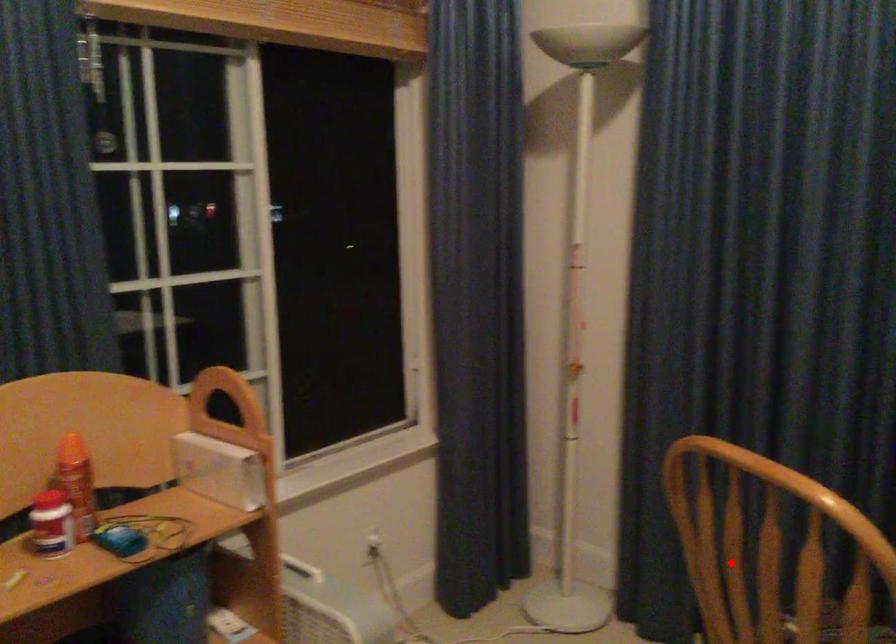
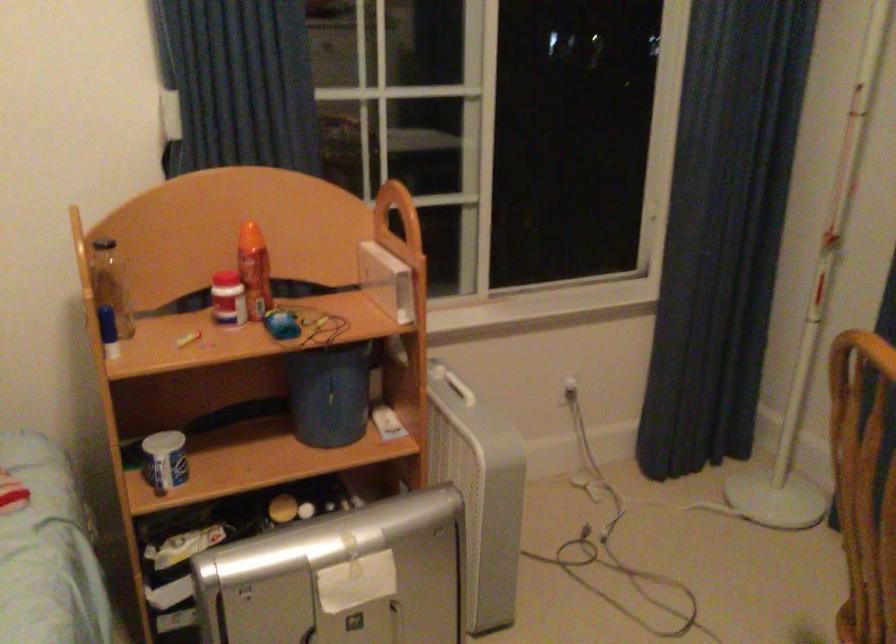
Question: I am providing you with two images of the same scene from different viewpoints. Image1 has a red point marked. In image2, the corresponding 3D location appears at what relative position? Reply with the corresponding letter.

Choices:
 (A) Closer
 (B) Farther

Answer: (A)